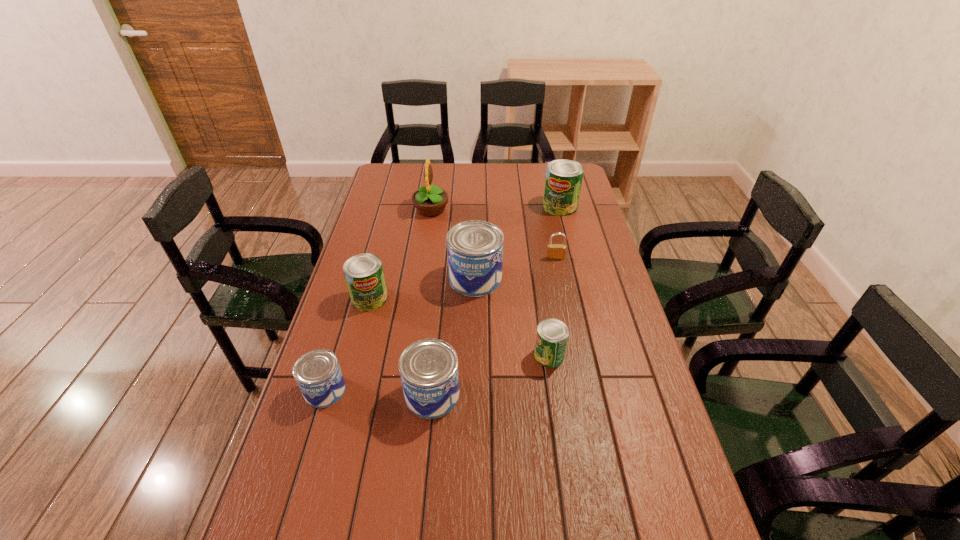
Where is `vacant space that satisfies the following two spatial constraints: 1. on the front side of the farthest green can; 2. on the front label of the farthest blue can`? The width and height of the screenshot is (960, 540). vacant space that satisfies the following two spatial constraints: 1. on the front side of the farthest green can; 2. on the front label of the farthest blue can is located at coordinates (578, 279).

Where is `free space in the image that satisfies the following two spatial constraints: 1. on the back side of the nearest green can; 2. on the front label of the biggest blue can`? The image size is (960, 540). free space in the image that satisfies the following two spatial constraints: 1. on the back side of the nearest green can; 2. on the front label of the biggest blue can is located at coordinates (538, 279).